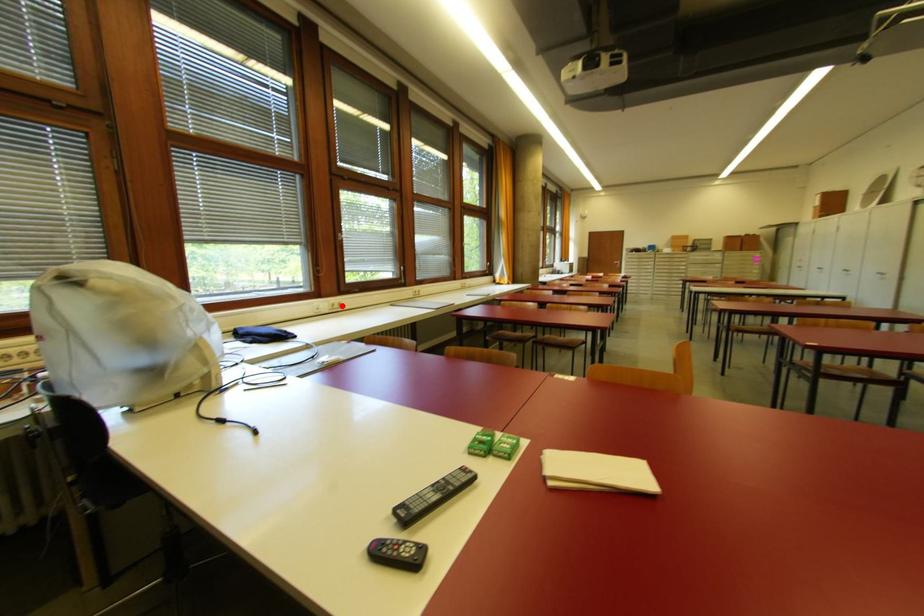
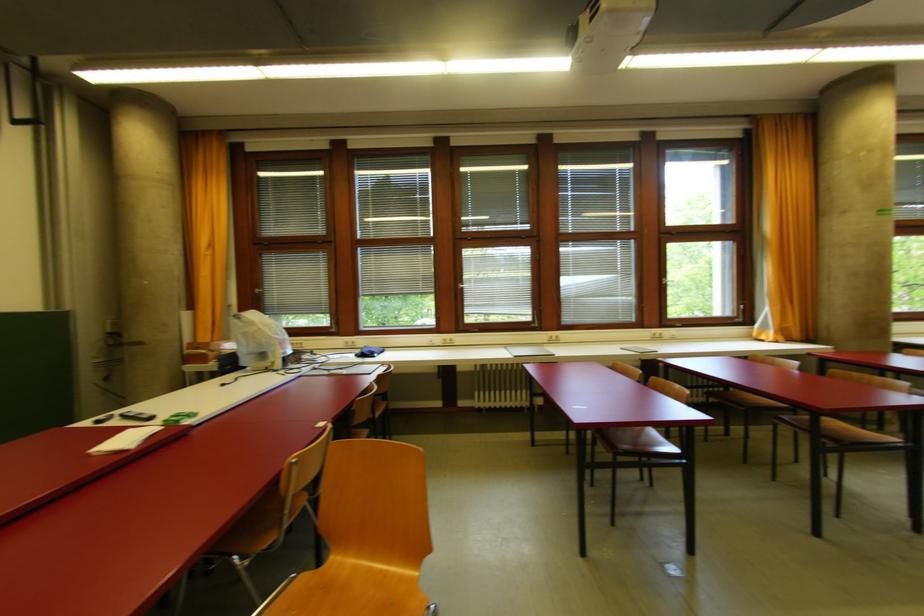
The point at the highlighted location is marked in the first image. Where is the corresponding point in the second image?

(454, 342)